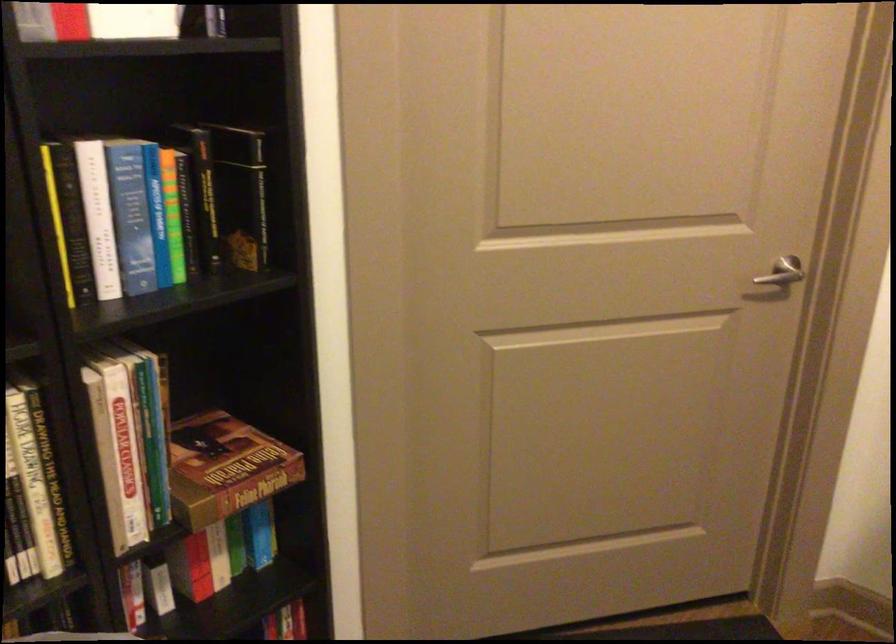
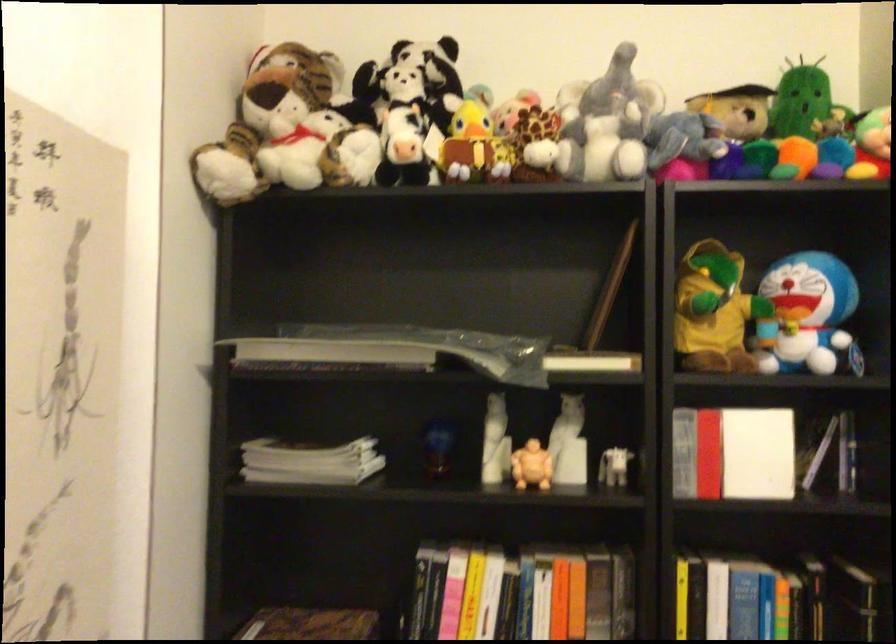
Find the pixel in the second image that matches point 165,178 in the first image.

(780, 599)